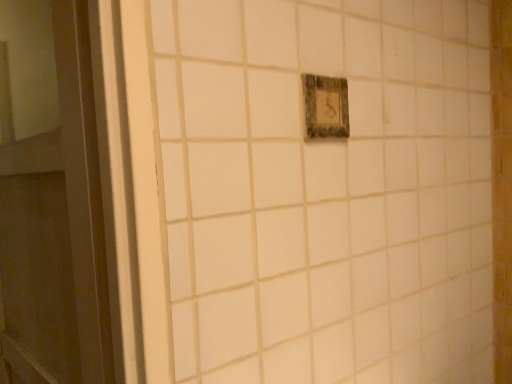
Question: Can you confirm if white glossy door at left is positioned to the left of rustic wood light switch at center?

Choices:
 (A) no
 (B) yes

Answer: (B)

Question: From a real-world perspective, is white glossy door at left positioned under rustic wood light switch at center based on gravity?

Choices:
 (A) yes
 (B) no

Answer: (A)

Question: Is white glossy door at left positioned before rustic wood light switch at center?

Choices:
 (A) yes
 (B) no

Answer: (A)

Question: Could you tell me if white glossy door at left is turned towards rustic wood light switch at center?

Choices:
 (A) no
 (B) yes

Answer: (A)

Question: From the image's perspective, is white glossy door at left beneath rustic wood light switch at center?

Choices:
 (A) yes
 (B) no

Answer: (A)

Question: Is white glossy door at left behind rustic wood light switch at center?

Choices:
 (A) yes
 (B) no

Answer: (B)

Question: Does rustic wood light switch at center have a lesser height compared to white glossy door at left?

Choices:
 (A) yes
 (B) no

Answer: (A)

Question: From a real-world perspective, is rustic wood light switch at center physically below white glossy door at left?

Choices:
 (A) no
 (B) yes

Answer: (A)

Question: Is rustic wood light switch at center smaller than white glossy door at left?

Choices:
 (A) no
 (B) yes

Answer: (B)

Question: Would you consider rustic wood light switch at center to be distant from white glossy door at left?

Choices:
 (A) no
 (B) yes

Answer: (A)

Question: From the image's perspective, is rustic wood light switch at center under white glossy door at left?

Choices:
 (A) yes
 (B) no

Answer: (B)

Question: Is rustic wood light switch at center to the left of white glossy door at left from the viewer's perspective?

Choices:
 (A) no
 (B) yes

Answer: (A)

Question: Considering their positions, is rustic wood light switch at center located in front of or behind white glossy door at left?

Choices:
 (A) behind
 (B) front

Answer: (A)